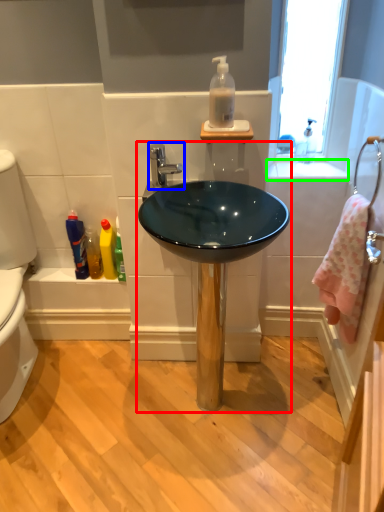
Question: Which object is positioned closest to sink (highlighted by a red box)? Select from tap (highlighted by a blue box) and counter top (highlighted by a green box).

Choices:
 (A) tap
 (B) counter top

Answer: (A)